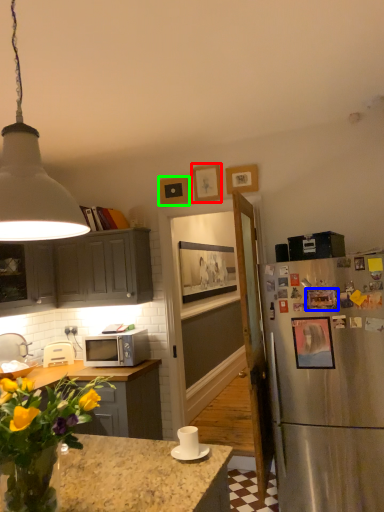
Question: Estimate the real-world distances between objects in this image. Which object is closer to picture frame (highlighted by a red box), picture frame (highlighted by a blue box) or picture frame (highlighted by a green box)?

Choices:
 (A) picture frame
 (B) picture frame

Answer: (B)